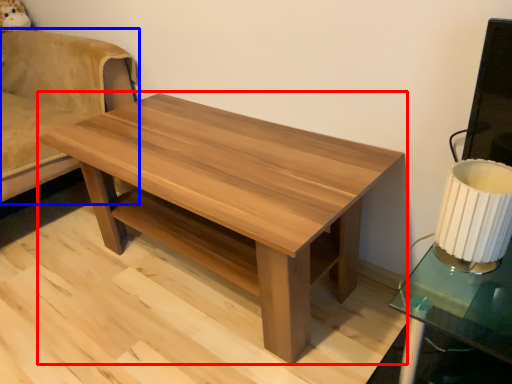
Question: Which object is further to the camera taking this photo, coffee table (highlighted by a red box) or swivel chair (highlighted by a blue box)?

Choices:
 (A) coffee table
 (B) swivel chair

Answer: (B)